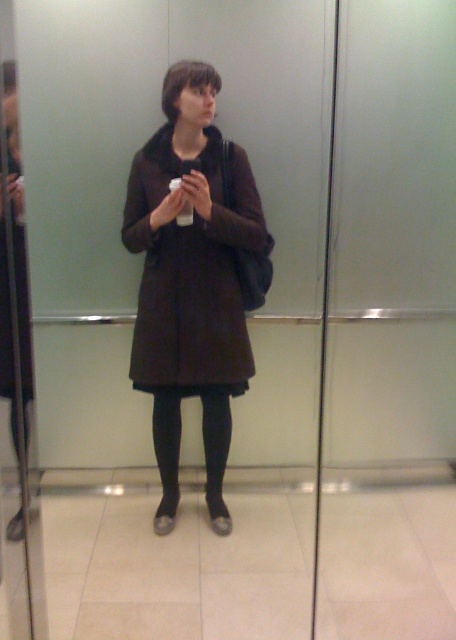
Does matte brown coat at center appear over black tights at lower center?

Correct, matte brown coat at center is located above black tights at lower center.

Which is behind, point (237, 189) or point (155, 436)?

Point (155, 436)

Where is `matte brown coat at center`? matte brown coat at center is located at coordinates (192, 273).